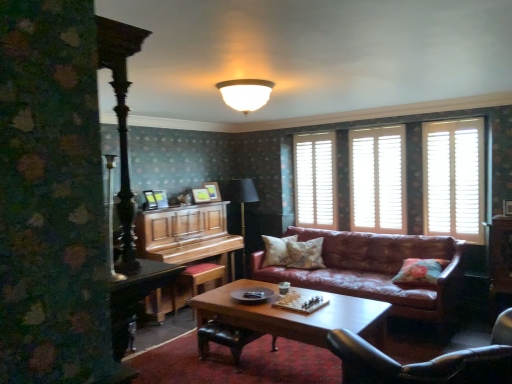
Question: Is wooden stool at lower left wider than leather couch at center?

Choices:
 (A) no
 (B) yes

Answer: (A)

Question: Is the depth of wooden stool at lower left greater than that of leather couch at center?

Choices:
 (A) no
 (B) yes

Answer: (B)

Question: Is leather couch at center at the back of wooden stool at lower left?

Choices:
 (A) no
 (B) yes

Answer: (A)

Question: Does wooden stool at lower left have a greater height compared to leather couch at center?

Choices:
 (A) no
 (B) yes

Answer: (A)

Question: From a real-world perspective, is wooden stool at lower left physically above leather couch at center?

Choices:
 (A) yes
 (B) no

Answer: (B)

Question: Based on their positions, is black leather chair at lower right located to the left or right of white wooden shutters at upper right?

Choices:
 (A) left
 (B) right

Answer: (A)

Question: Choose the correct answer: Is black leather chair at lower right inside white wooden shutters at upper right or outside it?

Choices:
 (A) inside
 (B) outside

Answer: (B)

Question: Looking at their shapes, would you say black leather chair at lower right is wider or thinner than white wooden shutters at upper right?

Choices:
 (A) wide
 (B) thin

Answer: (A)

Question: Does point (343, 347) appear closer or farther from the camera than point (333, 196)?

Choices:
 (A) closer
 (B) farther

Answer: (A)

Question: Considering the positions of point (169, 238) and point (200, 264), is point (169, 238) closer or farther from the camera than point (200, 264)?

Choices:
 (A) closer
 (B) farther

Answer: (A)

Question: Choose the correct answer: Is wooden piano at center inside wooden stool at lower left or outside it?

Choices:
 (A) outside
 (B) inside

Answer: (A)

Question: In terms of size, does wooden piano at center appear bigger or smaller than wooden stool at lower left?

Choices:
 (A) small
 (B) big

Answer: (B)

Question: From the image's perspective, is wooden piano at center located above or below wooden stool at lower left?

Choices:
 (A) below
 (B) above

Answer: (B)

Question: In terms of width, does black leather footrest at lower center look wider or thinner when compared to leather couch at center?

Choices:
 (A) wide
 (B) thin

Answer: (B)

Question: Is black leather footrest at lower center to the left or to the right of leather couch at center in the image?

Choices:
 (A) left
 (B) right

Answer: (A)